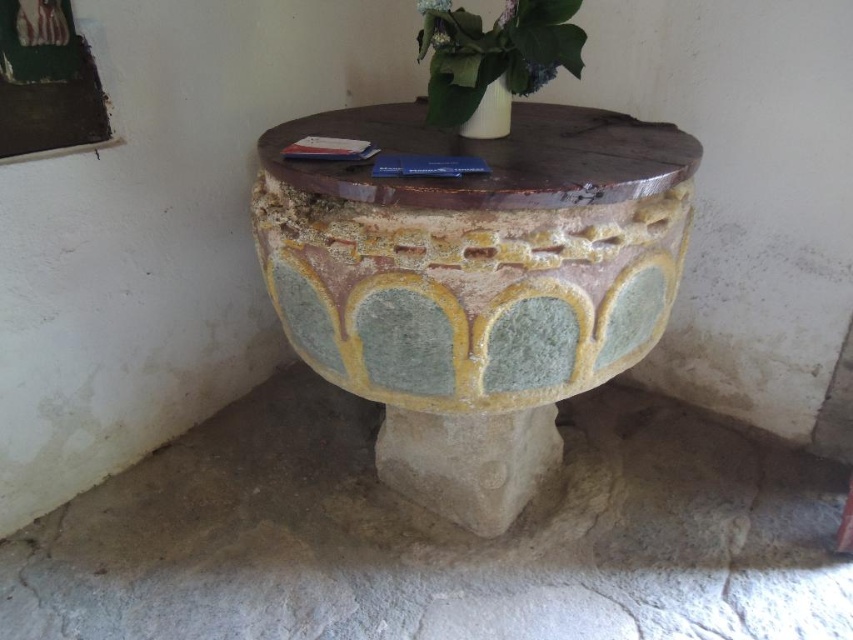
Between speckled stone table at center and green matte vase at upper center, which one is positioned lower?

speckled stone table at center

Is the position of speckled stone table at center less distant than that of green matte vase at upper center?

That is True.

Describe the element at coordinates (474, 282) in the screenshot. I see `speckled stone table at center` at that location.

Locate an element on the screen. The height and width of the screenshot is (640, 853). speckled stone table at center is located at coordinates (474, 282).

Does green matte vase at upper center have a smaller size compared to white glossy vase at upper center?

Incorrect, green matte vase at upper center is not smaller in size than white glossy vase at upper center.

Which is above, green matte vase at upper center or white glossy vase at upper center?

Positioned higher is green matte vase at upper center.

This screenshot has height=640, width=853. Identify the location of green matte vase at upper center. (494, 54).

Can you confirm if speckled stone table at center is taller than white glossy vase at upper center?

Yes.

Is speckled stone table at center to the right of white glossy vase at upper center from the viewer's perspective?

Incorrect, speckled stone table at center is not on the right side of white glossy vase at upper center.

Is point (474, 298) positioned behind point (486, 99)?

No, (474, 298) is in front of (486, 99).

Locate an element on the screen. This screenshot has height=640, width=853. speckled stone table at center is located at coordinates (474, 282).